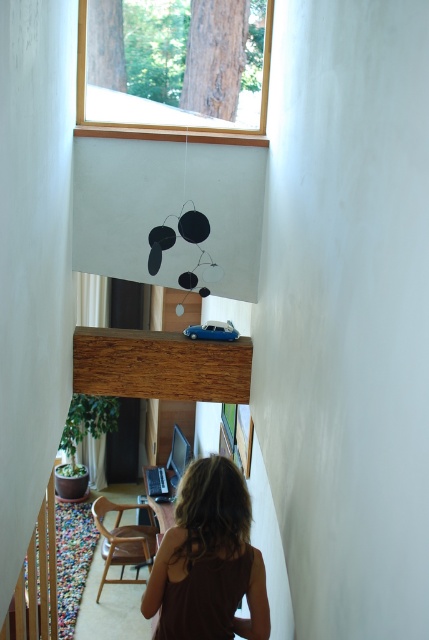
Question: In this image, where is wooden frame at upper center located relative to brown fabric at lower center?

Choices:
 (A) left
 (B) right

Answer: (A)

Question: Which of the following is the closest to the observer?

Choices:
 (A) wooden frame at upper center
 (B) brown fabric at lower center

Answer: (B)

Question: Does wooden frame at upper center appear on the left side of brown fabric at lower center?

Choices:
 (A) yes
 (B) no

Answer: (A)

Question: Among these points, which one is nearest to the camera?

Choices:
 (A) (144, 97)
 (B) (184, 541)

Answer: (B)

Question: Is wooden frame at upper center above brown fabric at lower center?

Choices:
 (A) no
 (B) yes

Answer: (B)